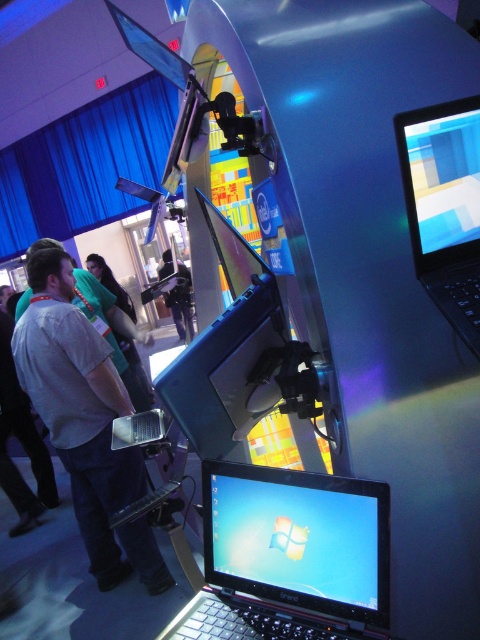
You are a photographer standing at the entrance of the exhibition hall. You want to take a photo of the light gray shirt at center and the dark blue fabric jacket at center. If your camera has a maximum focus range of 5 meters, will both subjects be in focus?

The light gray shirt at center is 6.19 meters away from dark blue fabric jacket at center. Since the maximum focus range is 5 meters, both subjects are beyond the camera range and cannot be in focus.

You are an event attendee at the tech exhibition and want to take a photo of both the black glossy laptop at center and the matte black laptop at upper right. Which laptop should you focus on first if you want to capture both in a single frame without moving your camera?

You should focus on the black glossy laptop at center first because it is shorter than the matte black laptop at upper right, allowing you to frame both within the camera view more easily by positioning the taller laptop at the edge.

You are attending a tech exhibition and want to interact with the laptops displayed on the curved structure. You are currently standing at the entrance, which is 2 meters away from the light gray shirt at center. Can you reach the laptops without moving closer than your current position?

The light gray shirt at center is 2.18 meters away from the viewer. Since you are 2 meters away, you are closer than the shirt, so you can reach the laptops without needing to move closer.